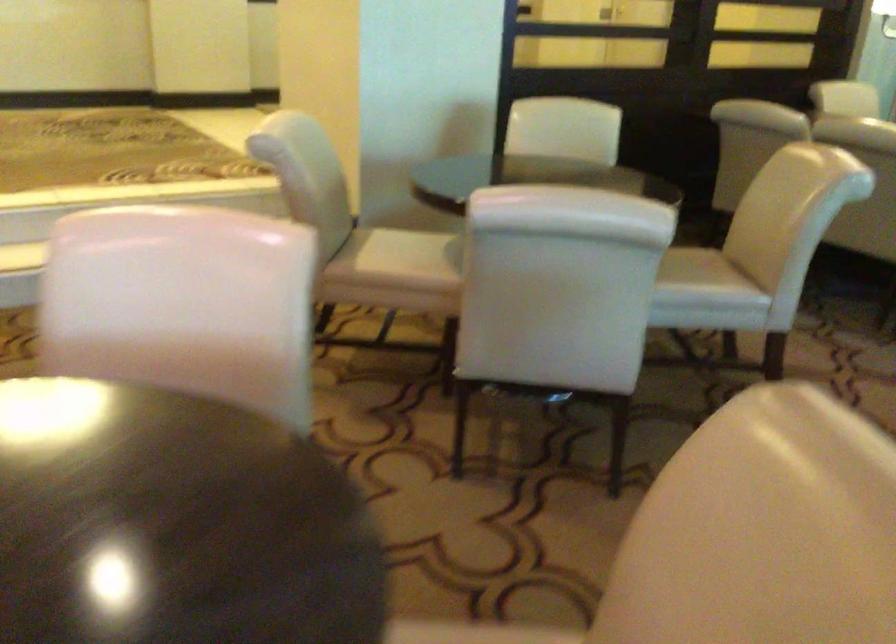
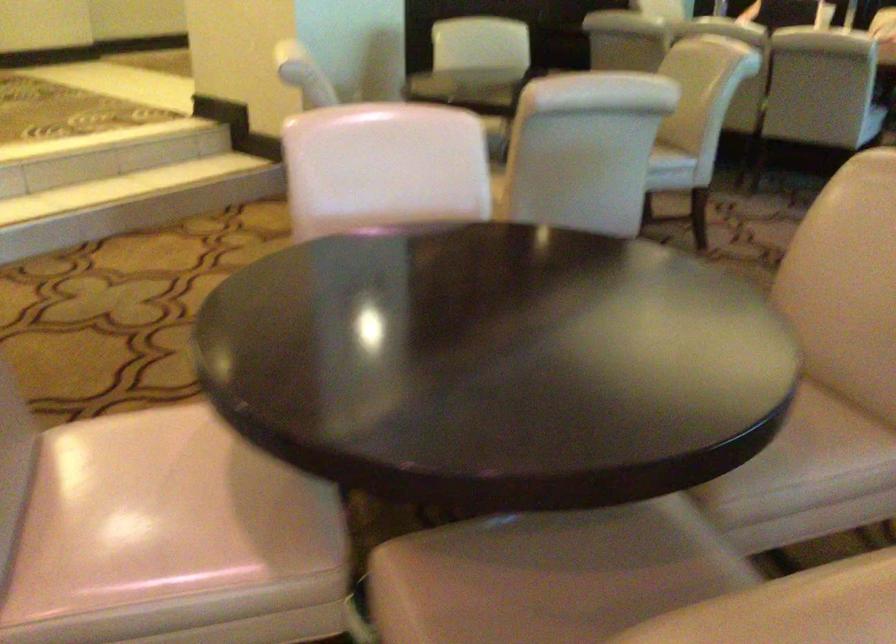
Which direction would the cameraman need to move to produce the second image?

The cameraman walked toward left, backward.